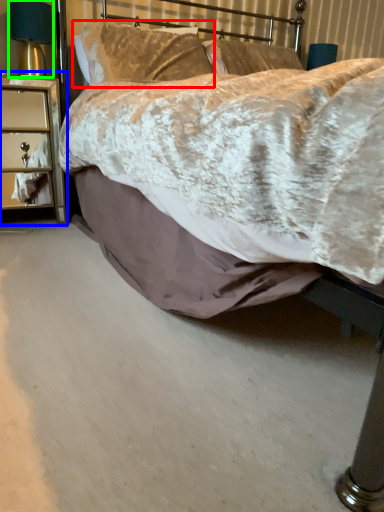
Question: Based on their relative distances, which object is farther from pillow (highlighted by a red box)? Choose from nightstand (highlighted by a blue box) and bedside lamp (highlighted by a green box).

Choices:
 (A) nightstand
 (B) bedside lamp

Answer: (A)